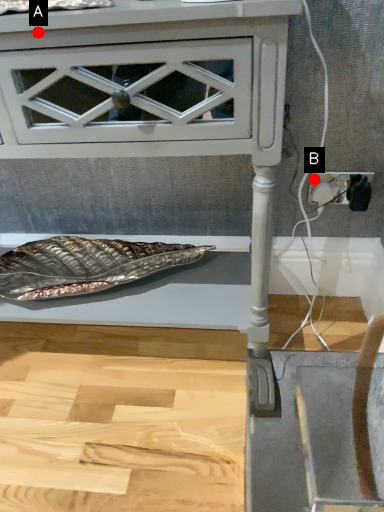
Question: Two points are circled on the image, labeled by A and B beside each circle. Which point is closer to the camera?

Choices:
 (A) A is closer
 (B) B is closer

Answer: (A)